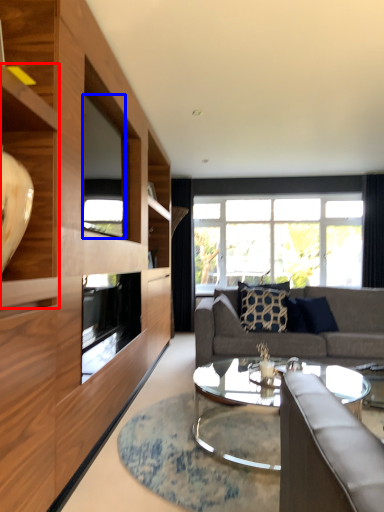
Question: Which point is further to the camera, shelf (highlighted by a red box) or window screen (highlighted by a blue box)?

Choices:
 (A) shelf
 (B) window screen

Answer: (B)